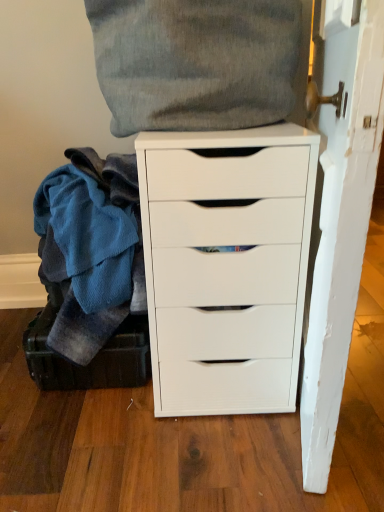
What are the coordinates of `free location in front of dark green leather suitcase at lower left` in the screenshot? It's located at (97, 453).